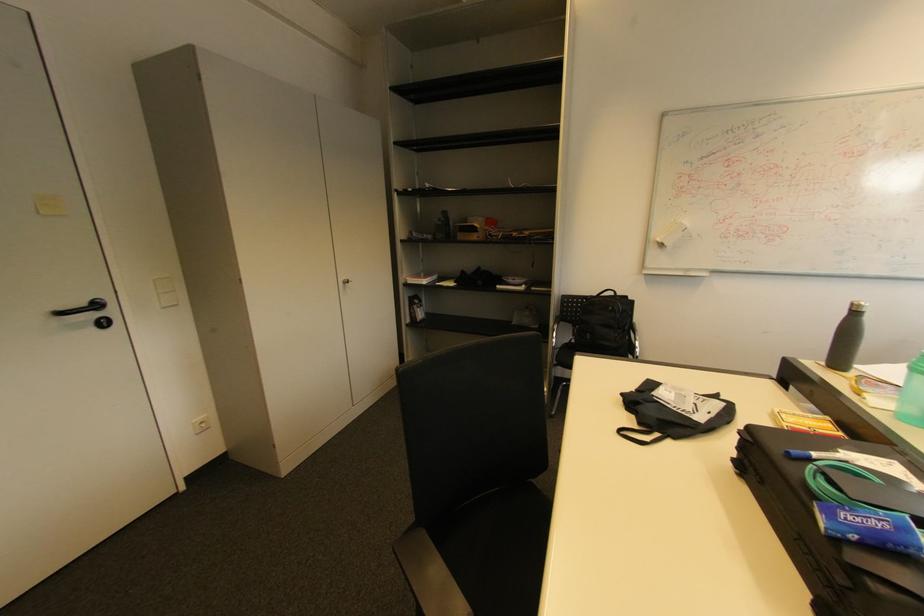
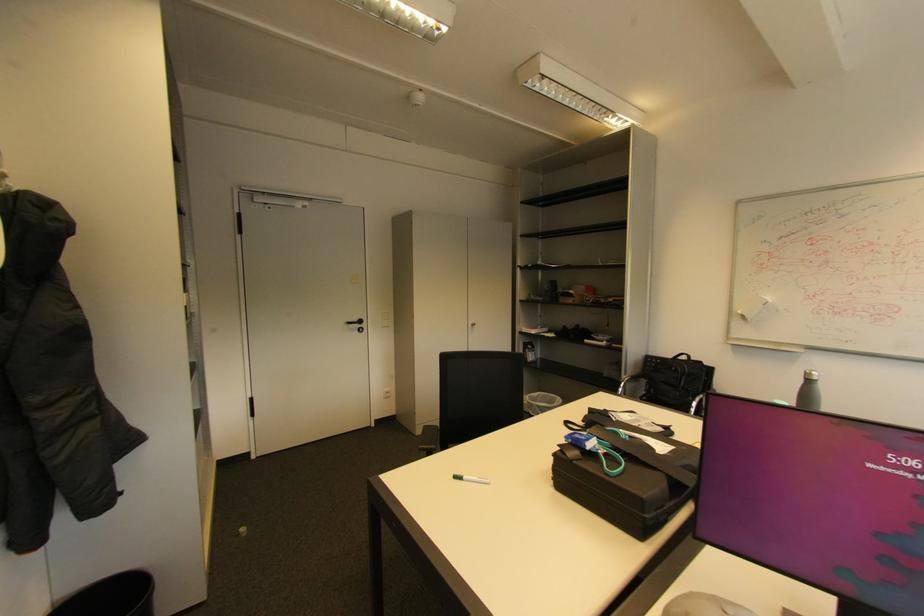
Locate, in the second image, the point that corresponds to the point at 615,309 in the first image.

(678, 369)